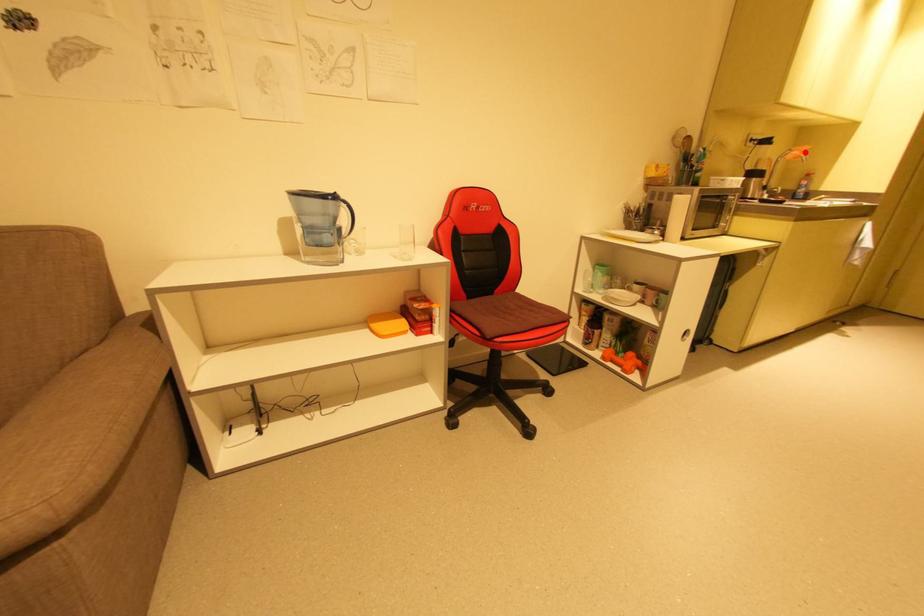
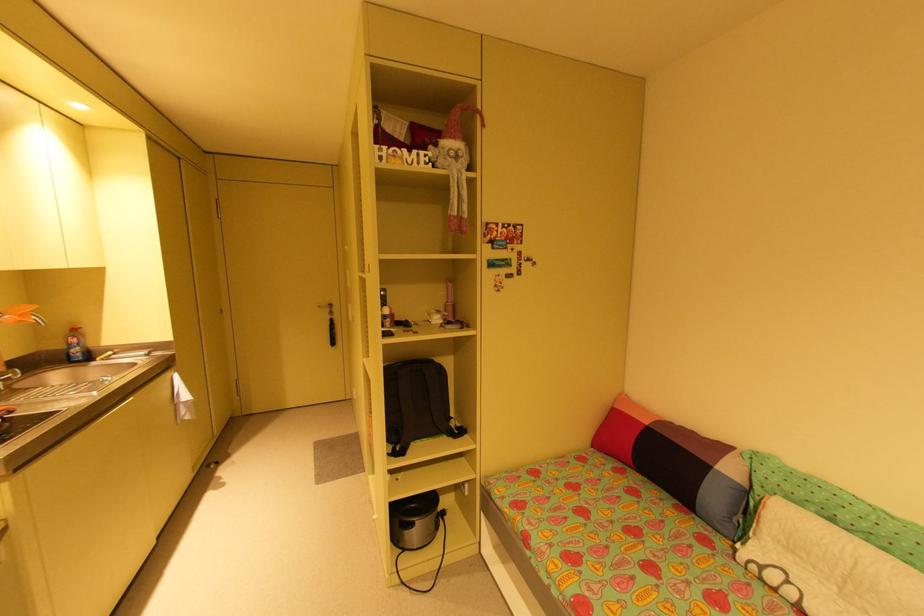
Locate, in the second image, the point that corresponds to the highlighted location in the first image.

(25, 315)